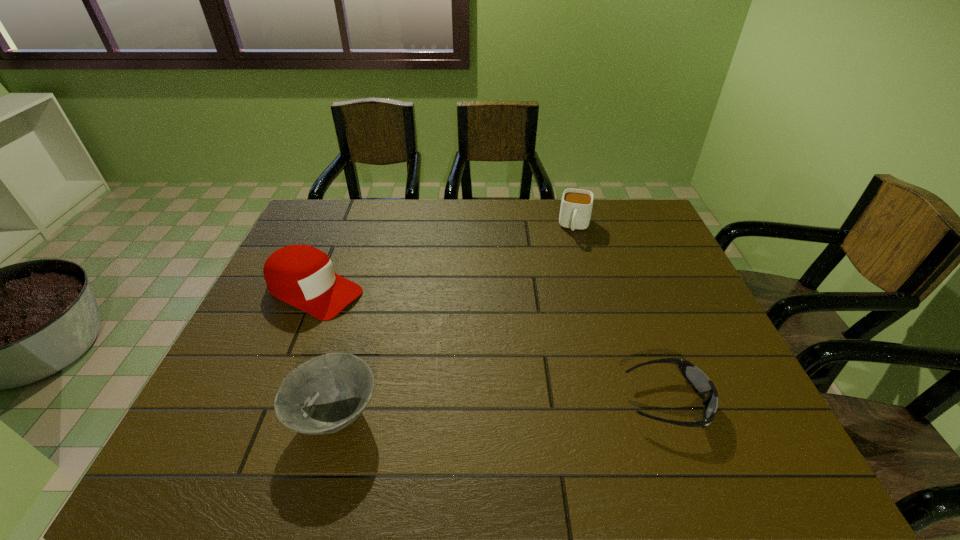
Find the location of a particular element. bowl is located at coordinates (327, 393).

The width and height of the screenshot is (960, 540). I want to click on the shortest object, so click(x=701, y=384).

The width and height of the screenshot is (960, 540). Find the location of `the farthest object`. the farthest object is located at coordinates (576, 206).

Identify the location of the second farthest object. The height and width of the screenshot is (540, 960). (300, 275).

The height and width of the screenshot is (540, 960). I want to click on free space located 0.190m on the left of the bowl, so [x=201, y=416].

Find the location of `vacant point located on the lenses of the shortest object`. vacant point located on the lenses of the shortest object is located at coordinates (745, 401).

Identify the location of free space located 0.060m on the side with the handle of the farthest object. This screenshot has width=960, height=540. (573, 251).

Where is `free region located on the side with the handle of the farthest object`? The width and height of the screenshot is (960, 540). free region located on the side with the handle of the farthest object is located at coordinates (565, 296).

At what (x,y) coordinates should I click in order to perform the action: click on free space located on the side with the handle of the farthest object. Please return your answer as a coordinate pair (x, y). Looking at the image, I should click on (562, 322).

Image resolution: width=960 pixels, height=540 pixels. Find the location of `free spot located 0.120m on the front-facing side of the baseball cap`. free spot located 0.120m on the front-facing side of the baseball cap is located at coordinates (387, 323).